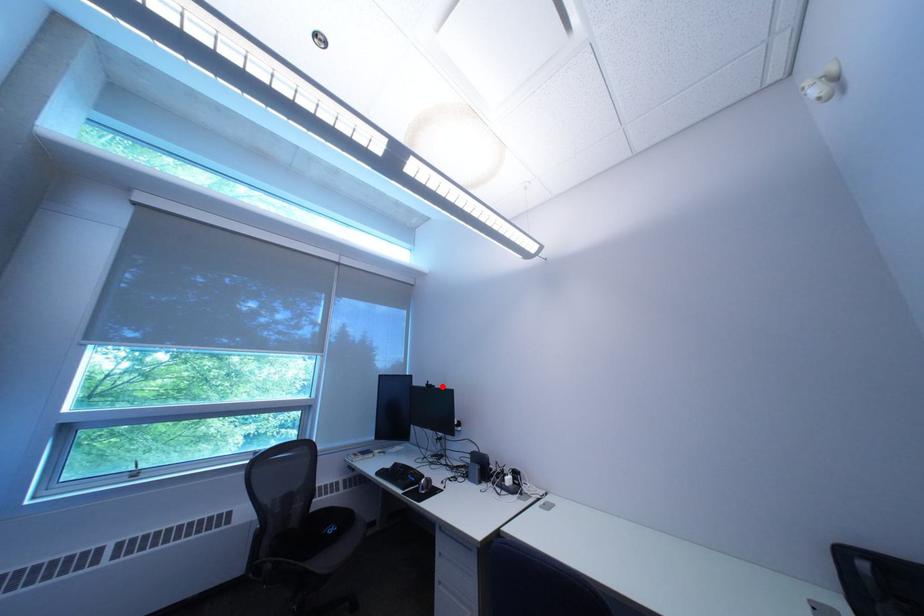
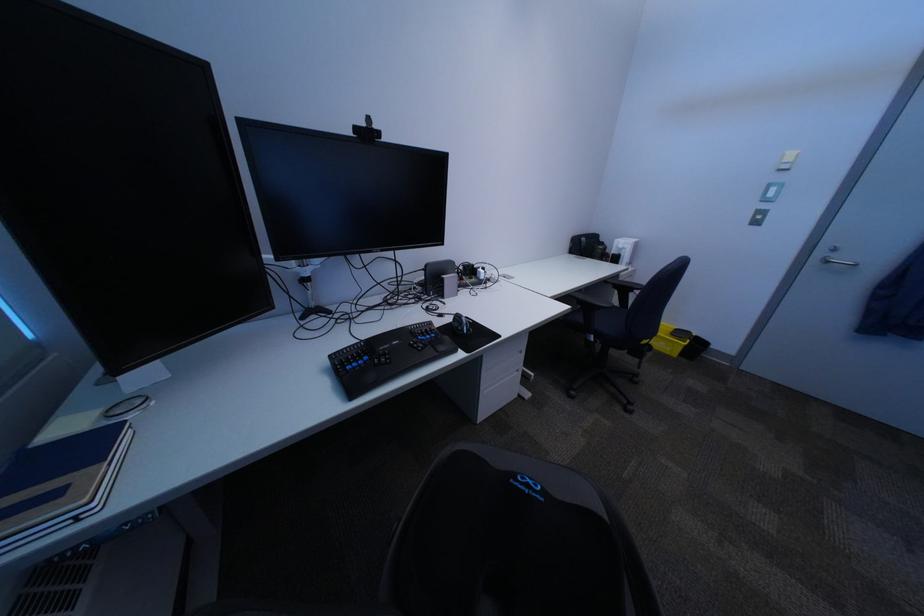
Question: I am providing you with two images of the same scene from different viewpoints. A red point is marked on the first image. Can you still see the location of the red point in image 2?

Choices:
 (A) Yes
 (B) No

Answer: (A)